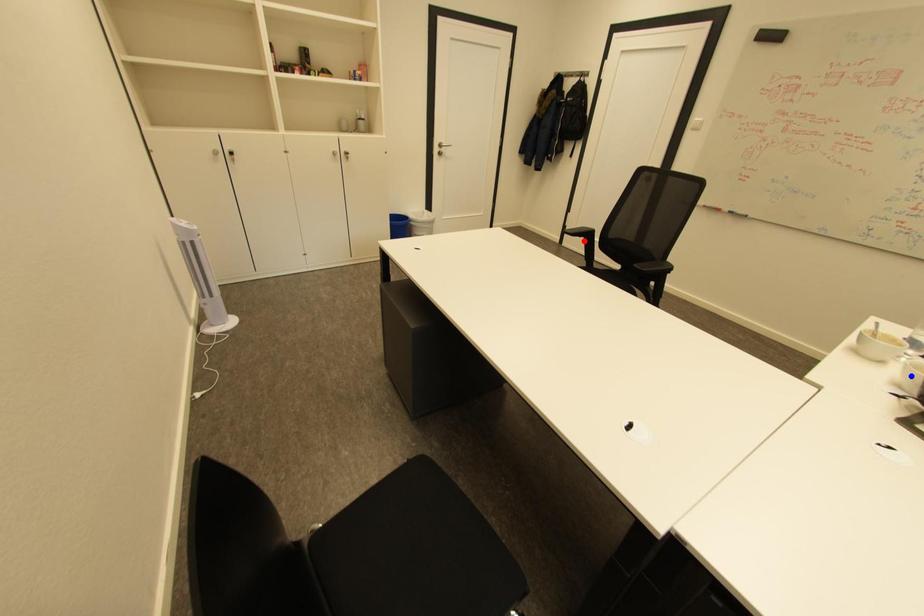
Question: Which of the two points in the image is closer to the camera?

Choices:
 (A) Blue point is closer.
 (B) Red point is closer.

Answer: (A)